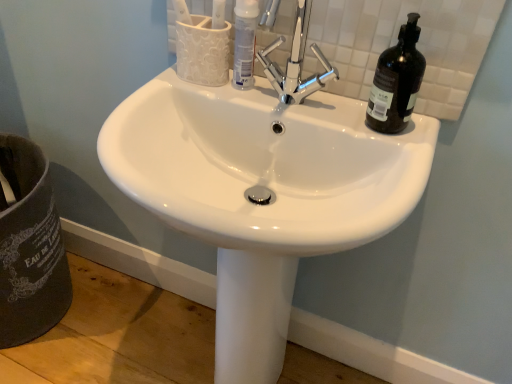
Image resolution: width=512 pixels, height=384 pixels. Identify the location of vacant space in front of black glass bottle at upper right. (403, 144).